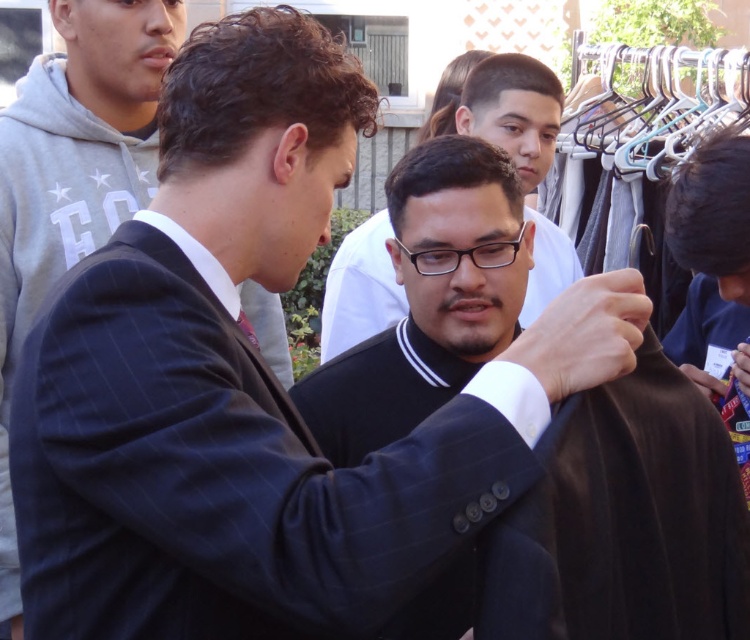
Question: Estimate the real-world distances between objects in this image. Which object is farther from the dark blue pinstripe suit at center?

Choices:
 (A) metallic silver hanger at upper right
 (B) red satin tie at center

Answer: (A)

Question: Does black smooth shirt at center appear over dark blue pinstripe suit at center?

Choices:
 (A) yes
 (B) no

Answer: (B)

Question: Is dark blue pinstripe suit at center thinner than black matte shirt at center?

Choices:
 (A) yes
 (B) no

Answer: (B)

Question: Estimate the real-world distances between objects in this image. Which object is farther from the metallic silver hanger at upper right?

Choices:
 (A) dark blue pinstripe suit at center
 (B) red satin tie at center
 (C) black smooth shirt at center

Answer: (B)

Question: Can you confirm if black matte shirt at center is positioned to the left of metallic silver hanger at upper right?

Choices:
 (A) yes
 (B) no

Answer: (A)

Question: Which object appears closest to the camera in this image?

Choices:
 (A) metallic silver hanger at upper right
 (B) black smooth shirt at center
 (C) red satin tie at center
 (D) dark blue pinstripe suit at center

Answer: (C)